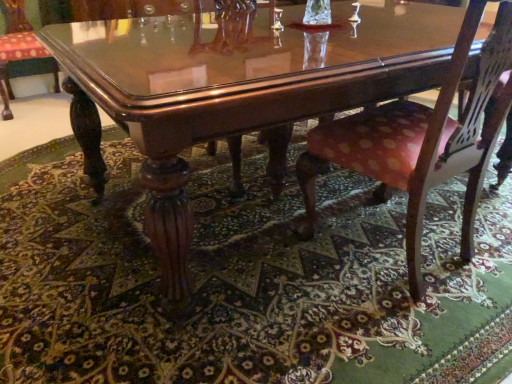
Question: Considering the relative positions of polka dot fabric chair at lower right, marked as the 1th chair in a bottom-to-top arrangement, and polished wood chair at lower left, which ranks as the second chair in front-to-back order, in the image provided, is polka dot fabric chair at lower right, marked as the 1th chair in a bottom-to-top arrangement, to the right of polished wood chair at lower left, which ranks as the second chair in front-to-back order, from the viewer's perspective?

Choices:
 (A) no
 (B) yes

Answer: (B)

Question: From the image's perspective, is polka dot fabric chair at lower right, which is the 2th chair in left-to-right order, on polished wood chair at lower left, the first chair from the left?

Choices:
 (A) no
 (B) yes

Answer: (A)

Question: Considering the relative sizes of polka dot fabric chair at lower right, marked as the 1th chair in a bottom-to-top arrangement, and polished wood chair at lower left, the first chair from the left, in the image provided, is polka dot fabric chair at lower right, marked as the 1th chair in a bottom-to-top arrangement, shorter than polished wood chair at lower left, the first chair from the left,?

Choices:
 (A) no
 (B) yes

Answer: (A)

Question: Considering the relative positions of polka dot fabric chair at lower right, which is the second chair in top-to-bottom order, and polished wood chair at lower left, placed as the second chair when sorted from right to left, in the image provided, is polka dot fabric chair at lower right, which is the second chair in top-to-bottom order, to the left of polished wood chair at lower left, placed as the second chair when sorted from right to left, from the viewer's perspective?

Choices:
 (A) no
 (B) yes

Answer: (A)

Question: Is polka dot fabric chair at lower right, marked as the 1th chair in a bottom-to-top arrangement, not close to polished wood chair at lower left, placed as the 1th chair when sorted from top to bottom?

Choices:
 (A) yes
 (B) no

Answer: (A)

Question: Considering the relative sizes of polka dot fabric chair at lower right, which is the second chair in top-to-bottom order, and polished wood chair at lower left, placed as the 1th chair when sorted from top to bottom, in the image provided, is polka dot fabric chair at lower right, which is the second chair in top-to-bottom order, taller than polished wood chair at lower left, placed as the 1th chair when sorted from top to bottom,?

Choices:
 (A) yes
 (B) no

Answer: (A)

Question: Does glossy wood coffee table at center appear on the left side of green patterned rug at lower center?

Choices:
 (A) yes
 (B) no

Answer: (B)

Question: From a real-world perspective, does glossy wood coffee table at center sit lower than green patterned rug at lower center?

Choices:
 (A) yes
 (B) no

Answer: (B)

Question: Is the depth of glossy wood coffee table at center greater than that of green patterned rug at lower center?

Choices:
 (A) yes
 (B) no

Answer: (A)

Question: Could you tell me if glossy wood coffee table at center is facing green patterned rug at lower center?

Choices:
 (A) yes
 (B) no

Answer: (B)

Question: Does glossy wood coffee table at center appear on the right side of green patterned rug at lower center?

Choices:
 (A) yes
 (B) no

Answer: (A)

Question: Considering the relative sizes of glossy wood coffee table at center and green patterned rug at lower center in the image provided, is glossy wood coffee table at center thinner than green patterned rug at lower center?

Choices:
 (A) no
 (B) yes

Answer: (B)

Question: Is green patterned rug at lower center closer to the viewer compared to glossy wood coffee table at center?

Choices:
 (A) yes
 (B) no

Answer: (A)